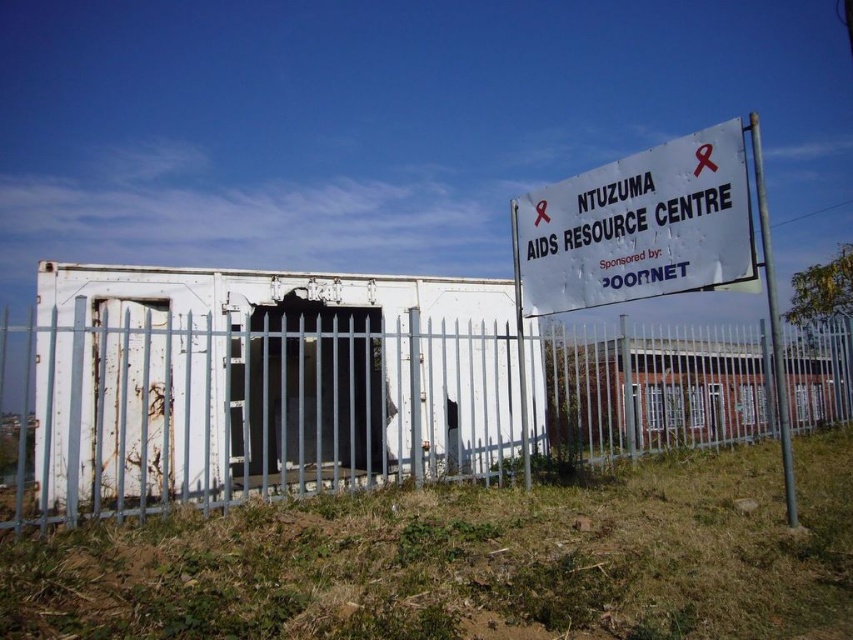
Question: Which point is farther from the camera taking this photo?

Choices:
 (A) (404, 296)
 (B) (100, 316)
 (C) (585, 209)

Answer: (A)

Question: Which point is farther to the camera?

Choices:
 (A) white paper sign at upper right
 (B) rusty metal cage at center
 (C) rusty metal door at center
 (D) rusty metal fence at center

Answer: (C)

Question: In this image, where is rusty metal cage at center located relative to white paper sign at upper right?

Choices:
 (A) below
 (B) above

Answer: (A)

Question: Which of the following is the farthest from the observer?

Choices:
 (A) click(x=401, y=384)
 (B) click(x=103, y=432)
 (C) click(x=308, y=403)
 (D) click(x=604, y=220)

Answer: (C)

Question: Can you confirm if rusty metal cage at center is positioned to the left of rusty metal door at center?

Choices:
 (A) no
 (B) yes

Answer: (A)

Question: Is rusty metal fence at center to the left of white paper sign at upper right from the viewer's perspective?

Choices:
 (A) yes
 (B) no

Answer: (A)